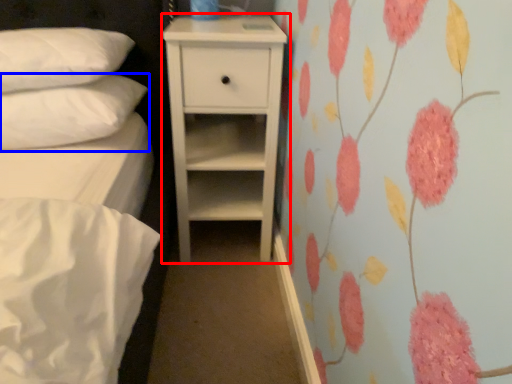
Question: Which point is further to the camera, chest of drawers (highlighted by a red box) or pillow (highlighted by a blue box)?

Choices:
 (A) chest of drawers
 (B) pillow

Answer: (A)